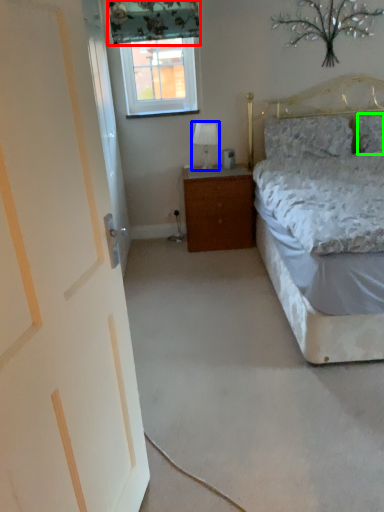
Question: Which object is the closest to the curtain (highlighted by a red box)? Choose among these: table lamp (highlighted by a blue box) or pillow (highlighted by a green box).

Choices:
 (A) table lamp
 (B) pillow

Answer: (A)